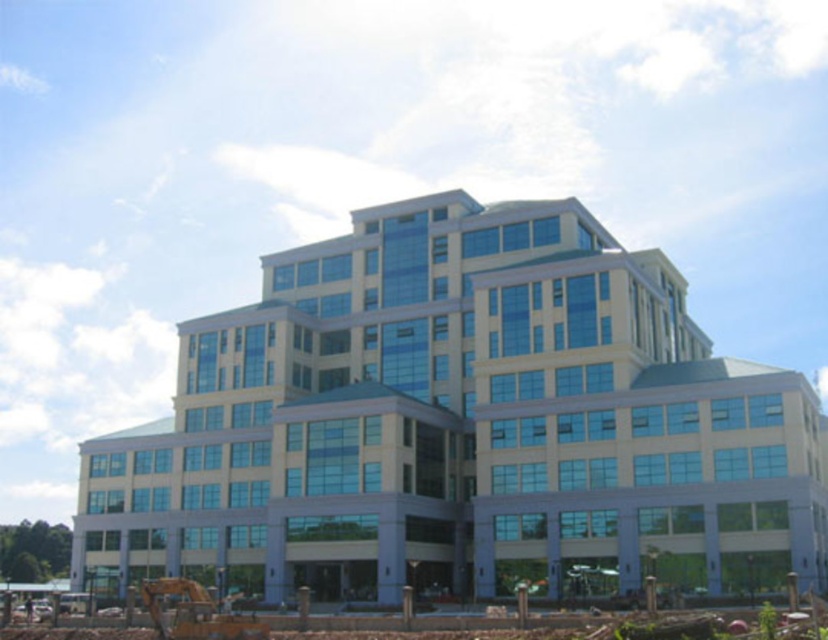
Question: Does blue glass building at center appear on the right side of yellow metallic excavator at lower left?

Choices:
 (A) no
 (B) yes

Answer: (B)

Question: Estimate the real-world distances between objects in this image. Which object is closer to the yellow metallic excavator at lower left?

Choices:
 (A) blue glass building at center
 (B) brown dirt at lower left

Answer: (B)

Question: Estimate the real-world distances between objects in this image. Which object is closer to the yellow metallic excavator at lower left?

Choices:
 (A) brown dirt at lower left
 (B) blue glass building at center

Answer: (A)

Question: Which object is the closest to the yellow metallic excavator at lower left?

Choices:
 (A) brown dirt at lower left
 (B) blue glass building at center

Answer: (A)

Question: Does brown dirt at lower left have a smaller size compared to yellow metallic excavator at lower left?

Choices:
 (A) no
 (B) yes

Answer: (A)

Question: Is blue glass building at center positioned before yellow metallic excavator at lower left?

Choices:
 (A) yes
 (B) no

Answer: (B)